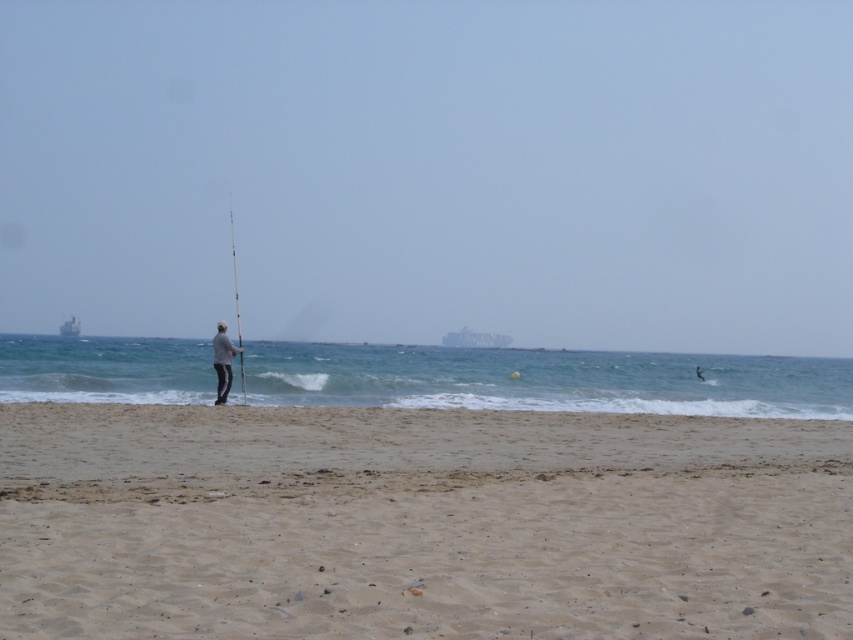
You are a photographer trying to capture the scene with the light gray fabric jacket at center and the smooth black pole at center. If you want to frame the jacket so it appears to the right of the pole in your photo, does the current arrangement allow that?

Yes, the light gray fabric jacket at center is already positioned to the right of the smooth black pole at center, so the current arrangement allows the jacket to appear to the right of the pole in the photo.